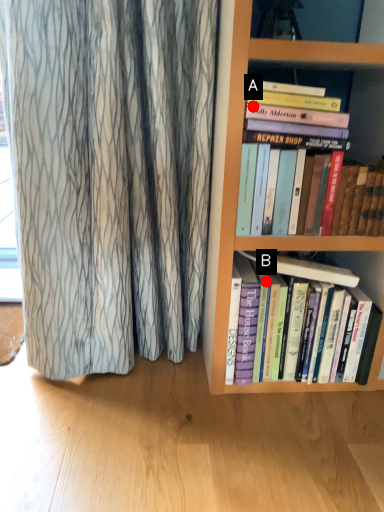
Question: Two points are circled on the image, labeled by A and B beside each circle. Which point is closer to the camera?

Choices:
 (A) A is closer
 (B) B is closer

Answer: (A)